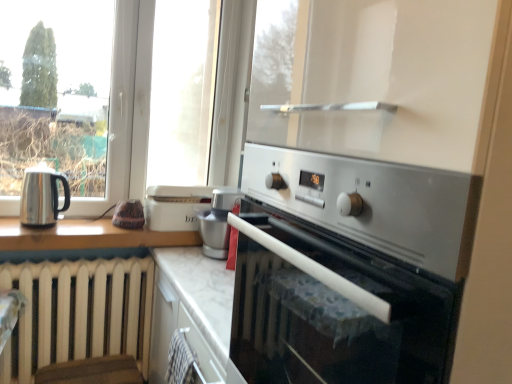
Question: Is satin silver oven at center surrounding satin silver appliance at center?

Choices:
 (A) yes
 (B) no

Answer: (B)

Question: Is satin silver oven at center positioned before satin silver appliance at center?

Choices:
 (A) no
 (B) yes

Answer: (B)

Question: Would you consider satin silver oven at center to be distant from satin silver appliance at center?

Choices:
 (A) no
 (B) yes

Answer: (A)

Question: Is satin silver oven at center thinner than satin silver appliance at center?

Choices:
 (A) yes
 (B) no

Answer: (B)

Question: From the image's perspective, is satin silver oven at center on satin silver appliance at center?

Choices:
 (A) yes
 (B) no

Answer: (B)

Question: Considering the positions of satin silver appliance at center and satin silver oven at center in the image, is satin silver appliance at center wider or thinner than satin silver oven at center?

Choices:
 (A) thin
 (B) wide

Answer: (A)

Question: Considering the relative positions of satin silver appliance at center and satin silver oven at center in the image provided, is satin silver appliance at center to the left or to the right of satin silver oven at center?

Choices:
 (A) left
 (B) right

Answer: (A)

Question: From the image's perspective, relative to satin silver oven at center, is satin silver appliance at center above or below?

Choices:
 (A) below
 (B) above

Answer: (B)

Question: Is satin silver appliance at center inside or outside of satin silver oven at center?

Choices:
 (A) inside
 (B) outside

Answer: (B)

Question: From the image's perspective, relative to shiny metallic kettle at left, is satin silver oven at center above or below?

Choices:
 (A) above
 (B) below

Answer: (B)

Question: Considering the positions of satin silver oven at center and shiny metallic kettle at left in the image, is satin silver oven at center taller or shorter than shiny metallic kettle at left?

Choices:
 (A) short
 (B) tall

Answer: (B)

Question: Is satin silver oven at center spatially inside shiny metallic kettle at left, or outside of it?

Choices:
 (A) inside
 (B) outside

Answer: (B)

Question: Considering the positions of satin silver oven at center and shiny metallic kettle at left in the image, is satin silver oven at center bigger or smaller than shiny metallic kettle at left?

Choices:
 (A) big
 (B) small

Answer: (A)

Question: Is satin silver appliance at center bigger or smaller than shiny metallic kettle at left?

Choices:
 (A) small
 (B) big

Answer: (B)

Question: Does point (206, 220) appear closer or farther from the camera than point (29, 220)?

Choices:
 (A) closer
 (B) farther

Answer: (B)